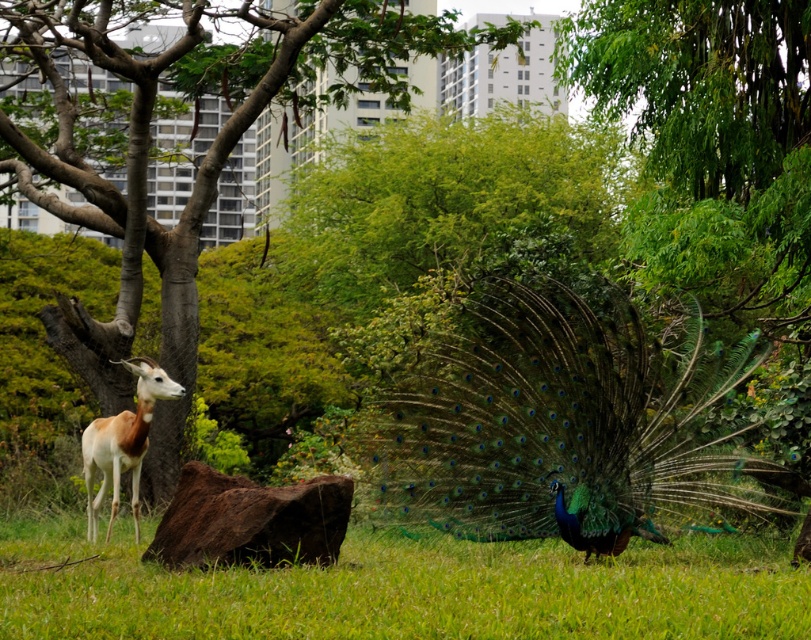
You are a photographer planning to take a photo of the smooth bark tree at center. You want to ensure the tree is centered in your shot. Based on the scene description, what are the coordinates you should aim for?

The smooth bark tree at center is located at coordinates point (177, 141), so you should aim for those coordinates to center it in your photo.

You are an artist trying to sketch this scene. You want to ensure the shiny green peacock at center and the smooth bark tree at center are proportionally accurate. Based on their sizes in the image, which one should you draw larger on your canvas?

The smooth bark tree at center should be drawn larger than the shiny green peacock at center because the shiny green peacock at center is smaller than the smooth bark tree at center in the image.